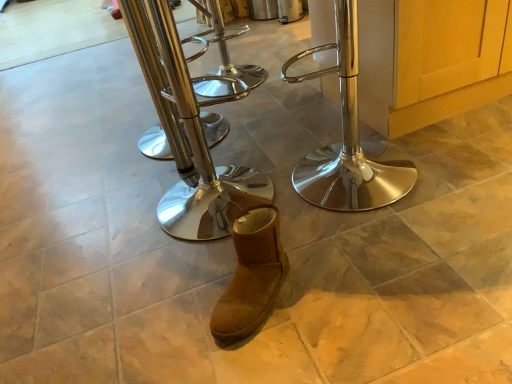
You are a GUI agent. You are given a task and a screenshot of the screen. Output one action in this format:
    pyautogui.click(x=<x>, y=<y>)
    Task: Click on the unoccupied space behind polished chrome stool at center, which appears as the 1th step stool when viewed from the right
    The width and height of the screenshot is (512, 384).
    Given the screenshot: What is the action you would take?
    pyautogui.click(x=288, y=140)